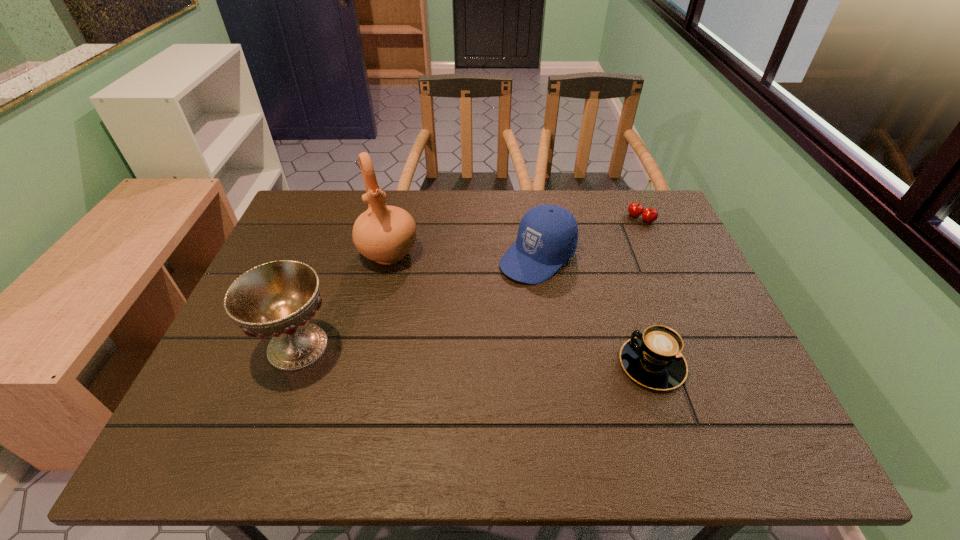
This screenshot has height=540, width=960. What are the coordinates of `vacant region between the cap and the chalice` in the screenshot? It's located at click(x=418, y=302).

The height and width of the screenshot is (540, 960). I want to click on free space between the cap and the cappuccino, so click(594, 310).

You are a GUI agent. You are given a task and a screenshot of the screen. Output one action in this format:
    pyautogui.click(x=<x>, y=<y>)
    Task: Click on the free space between the cappuccino and the second tallest object
    This screenshot has width=960, height=540.
    Given the screenshot: What is the action you would take?
    pyautogui.click(x=474, y=355)

Image resolution: width=960 pixels, height=540 pixels. What are the coordinates of `vacant space that's between the third object from left to right and the tallest object` in the screenshot? It's located at (463, 255).

Select which object is the third closest to the farthest object. Please provide its 2D coordinates. Your answer should be formatted as a tuple, i.e. [(x, y)], where the tuple contains the x and y coordinates of a point satisfying the conditions above.

[(385, 234)]

Select which object appears as the closest to the rightmost object. Please provide its 2D coordinates. Your answer should be formatted as a tuple, i.e. [(x, y)], where the tuple contains the x and y coordinates of a point satisfying the conditions above.

[(547, 237)]

This screenshot has width=960, height=540. Find the location of `vacant point that satisfies the following two spatial constraints: 1. on the back side of the third object from right to left; 2. on the right side of the cherry`. vacant point that satisfies the following two spatial constraints: 1. on the back side of the third object from right to left; 2. on the right side of the cherry is located at coordinates (532, 218).

Identify the location of vacant position in the image that satisfies the following two spatial constraints: 1. on the back side of the third object from left to right; 2. on the right side of the chalice. (330, 257).

Identify the location of blank space that satisfies the following two spatial constraints: 1. on the back side of the pottery; 2. on the right side of the chalice. coord(332,253).